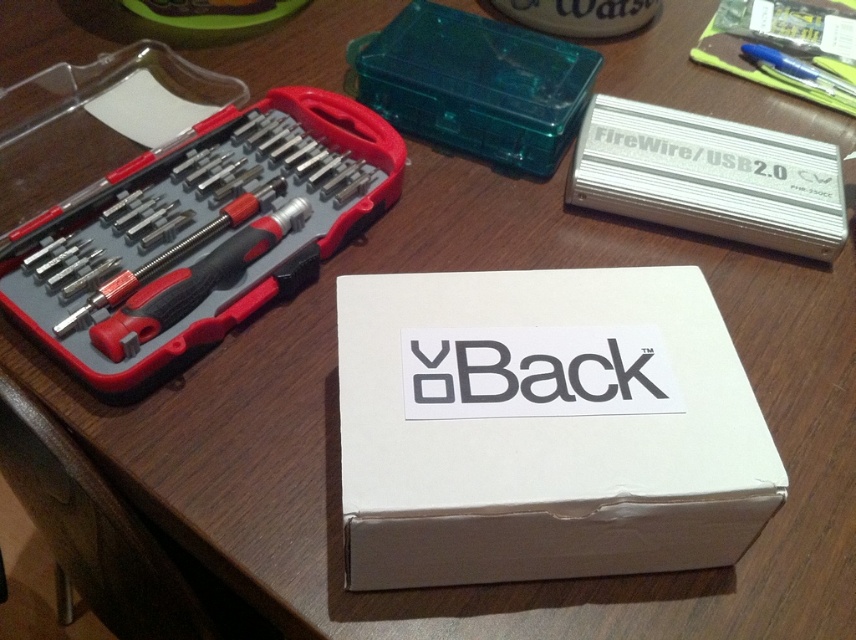
You are organizing tools on a desk and notice the black plastic screwdriver set at left and the red plastic screwdriver at left. Which one is placed on top of the other?

The black plastic screwdriver set at left is positioned over red plastic screwdriver at left, so the black plastic screwdriver set at left is on top.

You are holding a camera and want to take a closeup shot of the transparent plastic case at upper center. Based on the scene description, can you estimate whether the camera is currently positioned far enough to capture the entire case in one frame?

The transparent plastic case at upper center is 33.91 inches away from the camera. Since this distance is within typical closeup range for most cameras, the camera is likely positioned far enough to capture the entire case in one frame.

You are organizing tools on a desk and notice the transparent plastic case at upper center and the red plastic screwdriver at left. Which object is covering the other one?

The transparent plastic case at upper center is positioned over the red plastic screwdriver at left, so it is covering it.